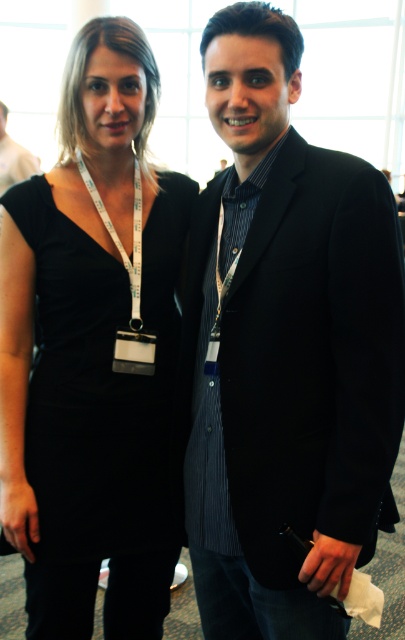
Is point (345, 244) in front of point (12, 200)?

Yes, it is in front of point (12, 200).

Looking at this image, which is above, black pinstripe suit at center or black matte dress at center?

black pinstripe suit at center

Between point (257, 566) and point (57, 472), which one is positioned in front?

Point (257, 566) is more forward.

Image resolution: width=405 pixels, height=640 pixels. I want to click on black pinstripe suit at center, so click(x=285, y=349).